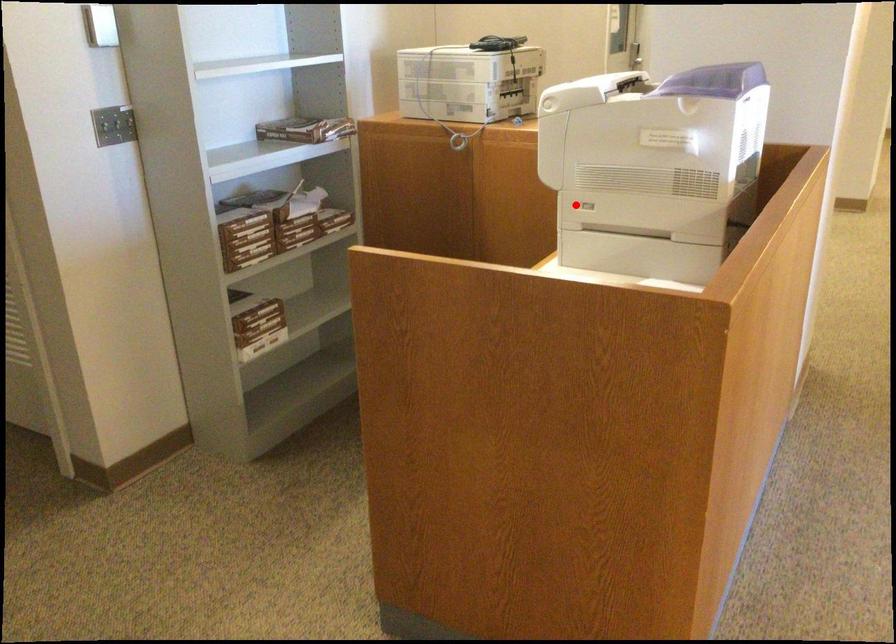
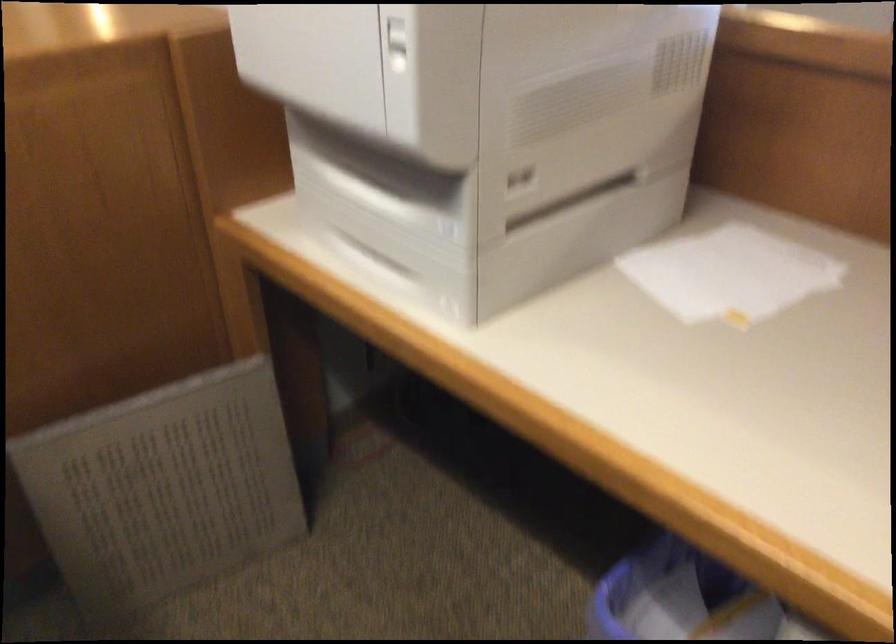
Question: I am providing you with two images of the same scene from different viewpoints. Given a red point in image1, look at the same physical point in image2. Is it:

Choices:
 (A) Closer to the viewpoint
 (B) Farther from the viewpoint

Answer: (A)